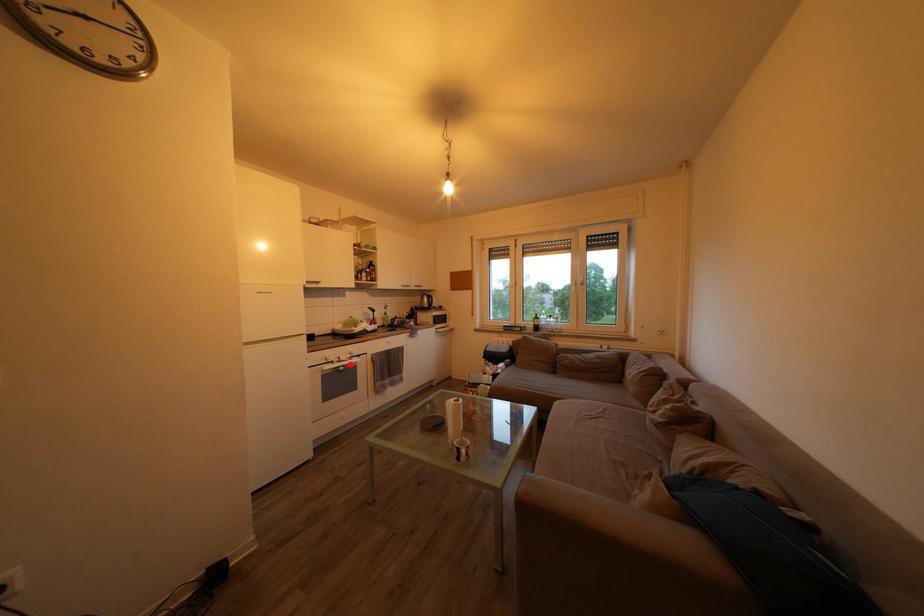
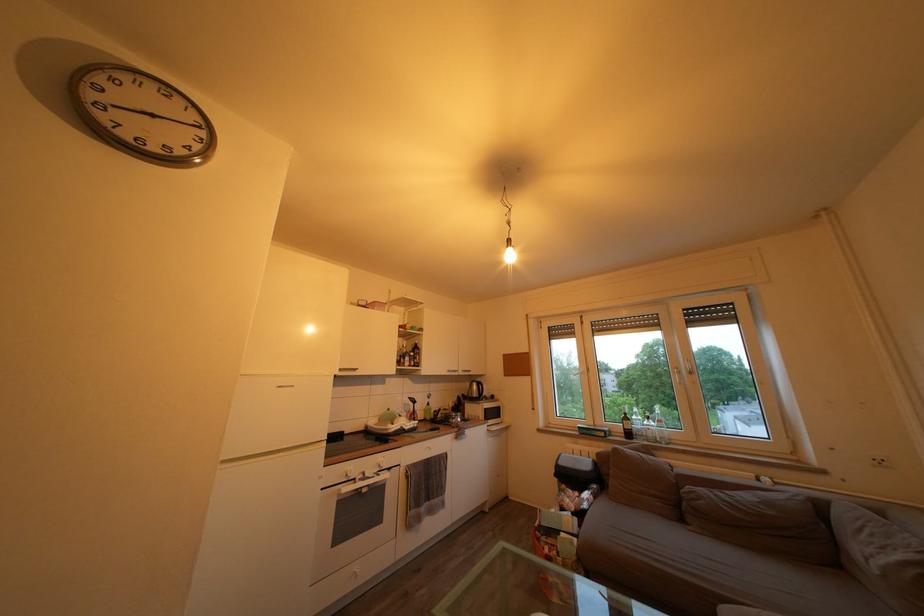
Question: I am providing you with two images of the same scene from different viewpoints. Given a red point in image1, look at the same physical point in image2. Is it:

Choices:
 (A) Closer to the viewpoint
 (B) Farther from the viewpoint

Answer: (B)